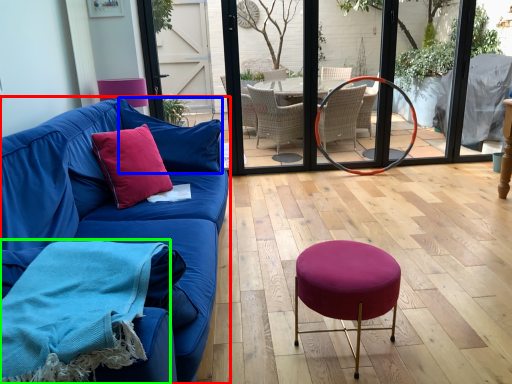
Question: Based on their relative distances, which object is nearer to studio couch (highlighted by a red box)? Choose from pillow (highlighted by a blue box) and blanket (highlighted by a green box).

Choices:
 (A) pillow
 (B) blanket

Answer: (A)